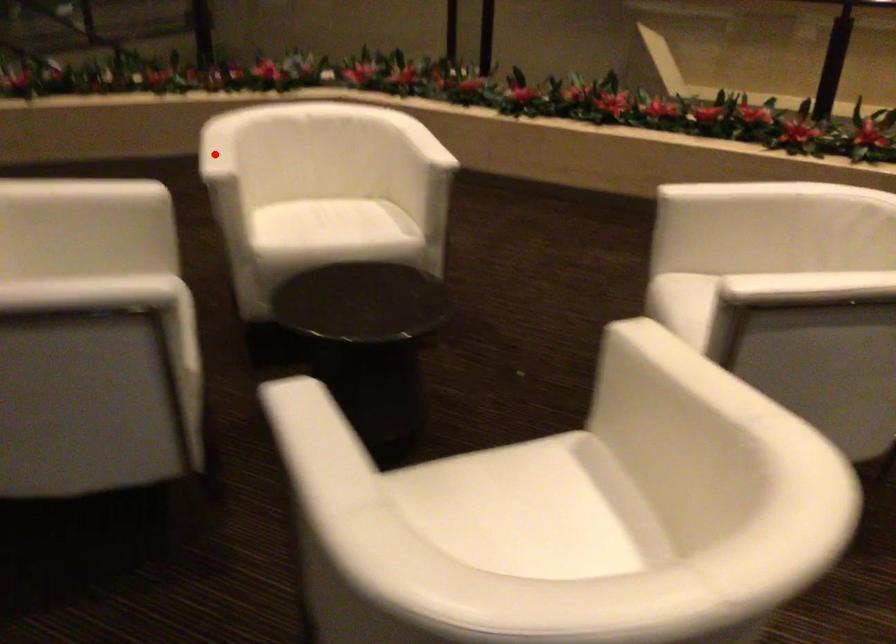
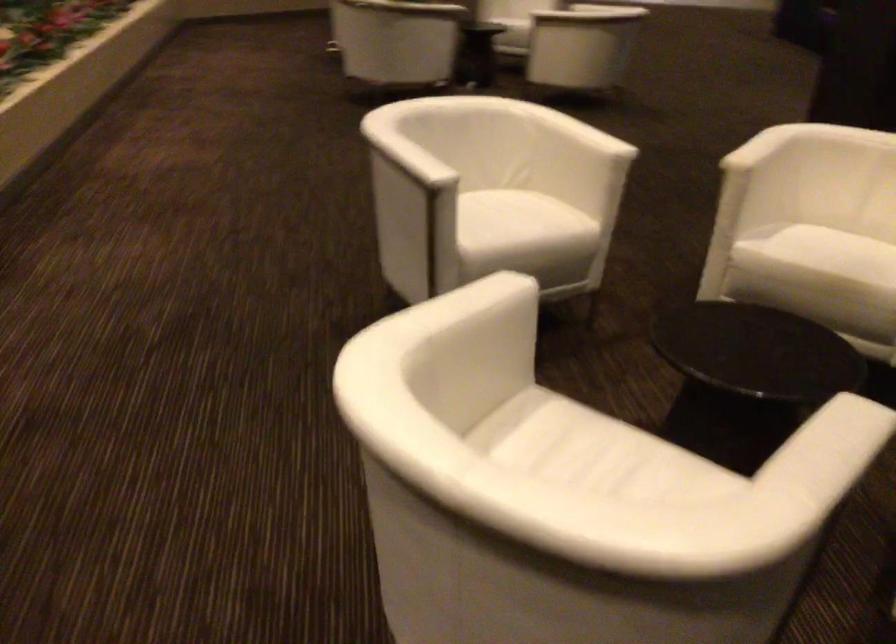
Locate, in the second image, the point that corresponds to the highlighted location in the first image.

(839, 446)